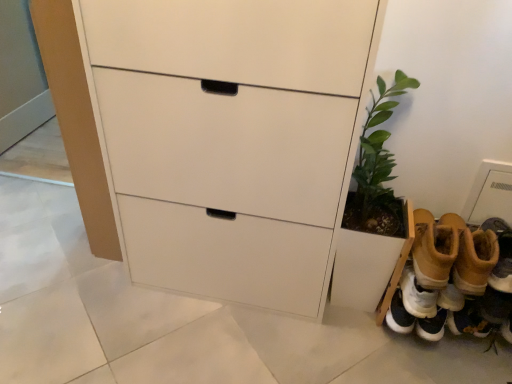
Question: Is tan suede boots at lower right, which appears as the 2th footwear when viewed from the right, far from white matte chest of drawers at center?

Choices:
 (A) yes
 (B) no

Answer: (B)

Question: Does tan suede boots at lower right, which appears as the 2th footwear when viewed from the right, have a greater height compared to white matte chest of drawers at center?

Choices:
 (A) no
 (B) yes

Answer: (A)

Question: Does tan suede boots at lower right, which appears as the first footwear when viewed from the left, appear on the left side of white matte chest of drawers at center?

Choices:
 (A) yes
 (B) no

Answer: (B)

Question: Can you confirm if tan suede boots at lower right, which appears as the first footwear when viewed from the left, is positioned to the right of white matte chest of drawers at center?

Choices:
 (A) no
 (B) yes

Answer: (B)

Question: Does tan suede boots at lower right, which appears as the first footwear when viewed from the left, have a greater width compared to white matte chest of drawers at center?

Choices:
 (A) yes
 (B) no

Answer: (A)

Question: Considering their positions, is tan suede boots at lower right, placed as the second footwear when sorted from left to right, located in front of or behind green leafy plant at lower right?

Choices:
 (A) front
 (B) behind

Answer: (B)

Question: Looking at the image, does tan suede boots at lower right, positioned as the first footwear in right-to-left order, seem bigger or smaller compared to green leafy plant at lower right?

Choices:
 (A) big
 (B) small

Answer: (A)

Question: From a real-world perspective, is tan suede boots at lower right, placed as the second footwear when sorted from left to right, positioned above or below green leafy plant at lower right?

Choices:
 (A) above
 (B) below

Answer: (B)

Question: Is tan suede boots at lower right, positioned as the first footwear in right-to-left order, inside the boundaries of green leafy plant at lower right, or outside?

Choices:
 (A) inside
 (B) outside

Answer: (B)

Question: In terms of width, does green leafy plant at lower right look wider or thinner when compared to tan suede boots at lower right, placed as the second footwear when sorted from left to right?

Choices:
 (A) wide
 (B) thin

Answer: (A)

Question: From a real-world perspective, is green leafy plant at lower right above or below tan suede boots at lower right, placed as the second footwear when sorted from left to right?

Choices:
 (A) below
 (B) above

Answer: (B)

Question: In terms of height, does green leafy plant at lower right look taller or shorter compared to tan suede boots at lower right, positioned as the first footwear in right-to-left order?

Choices:
 (A) short
 (B) tall

Answer: (B)

Question: In the image, is green leafy plant at lower right positioned in front of or behind tan suede boots at lower right, placed as the second footwear when sorted from left to right?

Choices:
 (A) behind
 (B) front

Answer: (B)

Question: Is white matte chest of drawers at center situated inside green leafy plant at lower right or outside?

Choices:
 (A) inside
 (B) outside

Answer: (B)

Question: Relative to green leafy plant at lower right, is white matte chest of drawers at center in front or behind?

Choices:
 (A) front
 (B) behind

Answer: (A)